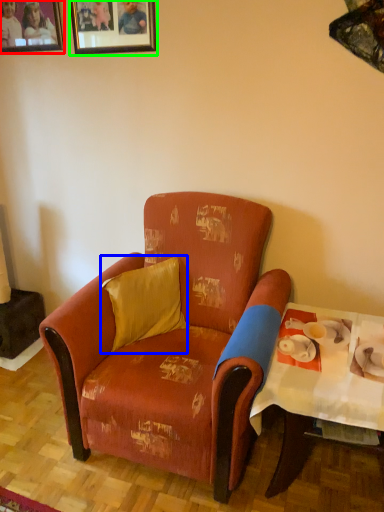
Question: Estimate the real-world distances between objects in this image. Which object is closer to picture frame (highlighted by a red box), pillow (highlighted by a blue box) or picture frame (highlighted by a green box)?

Choices:
 (A) pillow
 (B) picture frame

Answer: (B)